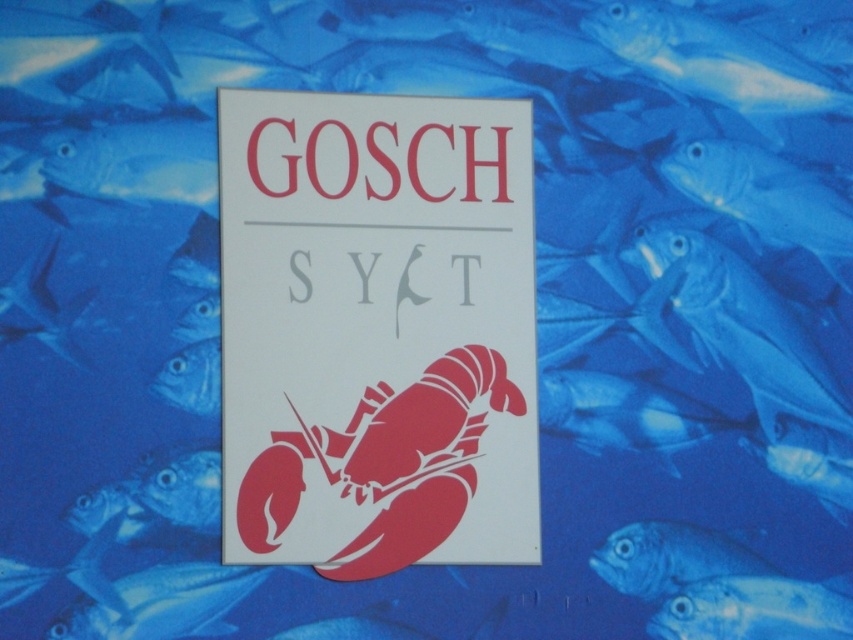
Does white paper sign at center have a lesser height compared to blue glossy fish at center?

In fact, white paper sign at center may be taller than blue glossy fish at center.

Does white paper sign at center appear on the left side of blue glossy fish at center?

Indeed, white paper sign at center is positioned on the left side of blue glossy fish at center.

Identify the location of white paper sign at center. (376, 332).

Is matte red text at center positioned behind gray matte text at center?

That is False.

Is matte red text at center thinner than gray matte text at center?

No, matte red text at center is not thinner than gray matte text at center.

Where is `matte red text at center`? matte red text at center is located at coordinates (372, 161).

Can you confirm if translucent blue fish at lower right is positioned below blue glossy fish at center?

Yes.

Is point (773, 609) positioned behind point (672, 524)?

Yes, point (773, 609) is behind point (672, 524).

You are a GUI agent. You are given a task and a screenshot of the screen. Output one action in this format:
    pyautogui.click(x=<x>, y=<y>)
    Task: Click on the translucent blue fish at lower right
    Image resolution: width=853 pixels, height=640 pixels.
    Given the screenshot: What is the action you would take?
    pyautogui.click(x=756, y=609)